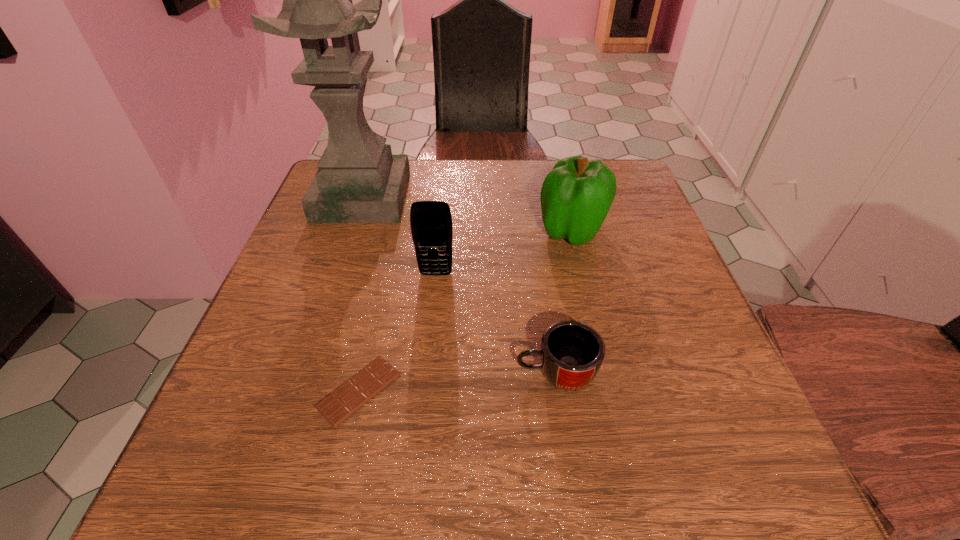
Where is `free space between the shortest object and the bell pepper`? Image resolution: width=960 pixels, height=540 pixels. free space between the shortest object and the bell pepper is located at coordinates (466, 310).

The image size is (960, 540). What are the coordinates of `free space between the third object from right to left and the bell pepper` in the screenshot? It's located at (504, 252).

Where is `vacant area between the cellular telephone and the shortest object`? vacant area between the cellular telephone and the shortest object is located at coordinates (397, 332).

The image size is (960, 540). I want to click on free spot between the cellular telephone and the chocolate bar, so click(x=397, y=332).

Locate an element on the screen. This screenshot has height=540, width=960. vacant space in between the chocolate bar and the bell pepper is located at coordinates (466, 310).

Identify the location of object that is the second closest to the sculpture. (576, 196).

Where is `object that stands as the second closest to the bell pepper`? The image size is (960, 540). object that stands as the second closest to the bell pepper is located at coordinates (571, 353).

Find the location of a particular element. This screenshot has height=540, width=960. vacant space that satisfies the following two spatial constraints: 1. on the front side of the bell pepper; 2. on the side of the mug with the handle is located at coordinates (606, 374).

Image resolution: width=960 pixels, height=540 pixels. Find the location of `blank area in the image that satisfies the following two spatial constraints: 1. at the front opening of the shortest object; 2. on the right side of the sculpture`. blank area in the image that satisfies the following two spatial constraints: 1. at the front opening of the shortest object; 2. on the right side of the sculpture is located at coordinates (298, 390).

Where is `free space that satisfies the following two spatial constraints: 1. at the front opening of the tallest object; 2. on the right side of the shortest object`? This screenshot has width=960, height=540. free space that satisfies the following two spatial constraints: 1. at the front opening of the tallest object; 2. on the right side of the shortest object is located at coordinates (298, 390).